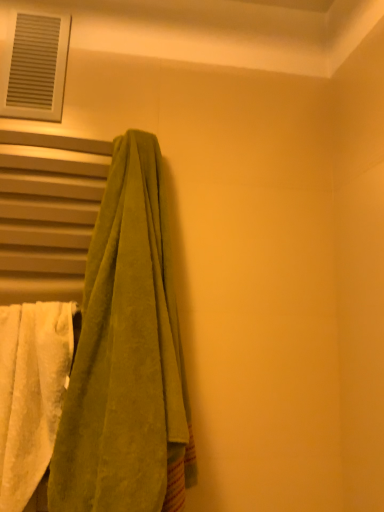
This screenshot has height=512, width=384. What do you see at coordinates (127, 356) in the screenshot?
I see `green velvety towel at left, the 1th towel in the right-to-left sequence` at bounding box center [127, 356].

Where is `white plastic vent at upper left`? white plastic vent at upper left is located at coordinates (35, 66).

Where is `green velvety towel at left, which is counted as the 2th towel, starting from the left`? This screenshot has width=384, height=512. green velvety towel at left, which is counted as the 2th towel, starting from the left is located at coordinates (127, 356).

From a real-world perspective, which is physically below, white plastic vent at upper left or white fluffy towel at left, placed as the 1th towel when sorted from left to right?

white fluffy towel at left, placed as the 1th towel when sorted from left to right.

Is white plastic vent at upper left positioned with its back to white fluffy towel at left, which is the second towel from right to left?

No, white plastic vent at upper left is not facing the opposite direction of white fluffy towel at left, which is the second towel from right to left.

From the image's perspective, which object appears higher, white plastic vent at upper left or white fluffy towel at left, which is the second towel from right to left?

white plastic vent at upper left.

Is white plastic vent at upper left placed right next to white fluffy towel at left, placed as the 1th towel when sorted from left to right?

No, white plastic vent at upper left is not making contact with white fluffy towel at left, placed as the 1th towel when sorted from left to right.

Which of these two, white fluffy towel at left, placed as the 1th towel when sorted from left to right, or green velvety towel at left, the 1th towel in the right-to-left sequence, is thinner?

With smaller width is white fluffy towel at left, placed as the 1th towel when sorted from left to right.

Could you tell me if white fluffy towel at left, placed as the 1th towel when sorted from left to right, is turned towards green velvety towel at left, the 1th towel in the right-to-left sequence?

No, white fluffy towel at left, placed as the 1th towel when sorted from left to right, is not facing towards green velvety towel at left, the 1th towel in the right-to-left sequence.

Considering the relative sizes of white fluffy towel at left, placed as the 1th towel when sorted from left to right, and green velvety towel at left, the 1th towel in the right-to-left sequence, in the image provided, is white fluffy towel at left, placed as the 1th towel when sorted from left to right, smaller than green velvety towel at left, the 1th towel in the right-to-left sequence,?

Yes, white fluffy towel at left, placed as the 1th towel when sorted from left to right, is smaller than green velvety towel at left, the 1th towel in the right-to-left sequence.

Consider the image. Considering the sizes of white plastic vent at upper left and green velvety towel at left, the 1th towel in the right-to-left sequence, in the image, is white plastic vent at upper left bigger or smaller than green velvety towel at left, the 1th towel in the right-to-left sequence,?

Clearly, white plastic vent at upper left is smaller in size than green velvety towel at left, the 1th towel in the right-to-left sequence.

From a real-world perspective, which object rests below the other?

In real-world perspective, green velvety towel at left, which is counted as the 2th towel, starting from the left, is lower.

From the image's perspective, which is below, white plastic vent at upper left or green velvety towel at left, the 1th towel in the right-to-left sequence?

green velvety towel at left, the 1th towel in the right-to-left sequence, from the image's perspective.

Is green velvety towel at left, the 1th towel in the right-to-left sequence, inside white plastic vent at upper left?

No, white plastic vent at upper left does not contain green velvety towel at left, the 1th towel in the right-to-left sequence.

Which of these two, green velvety towel at left, which is counted as the 2th towel, starting from the left, or white plastic vent at upper left, is bigger?

Bigger between the two is green velvety towel at left, which is counted as the 2th towel, starting from the left.

Considering the points (101, 476) and (10, 31), which point is in front, point (101, 476) or point (10, 31)?

The point (101, 476) is more forward.

Which object is thinner, green velvety towel at left, the 1th towel in the right-to-left sequence, or white plastic vent at upper left?

With smaller width is white plastic vent at upper left.

From the image's perspective, does green velvety towel at left, the 1th towel in the right-to-left sequence, appear higher than white plastic vent at upper left?

No.

From a real-world perspective, is green velvety towel at left, the 1th towel in the right-to-left sequence, positioned above or below white fluffy towel at left, which is the second towel from right to left?

In terms of real-world spatial position, green velvety towel at left, the 1th towel in the right-to-left sequence, is above white fluffy towel at left, which is the second towel from right to left.

Which is behind, green velvety towel at left, the 1th towel in the right-to-left sequence, or white fluffy towel at left, which is the second towel from right to left?

white fluffy towel at left, which is the second towel from right to left, is behind.

Is white fluffy towel at left, which is the second towel from right to left, far from white plastic vent at upper left?

No.

Is white plastic vent at upper left a part of white fluffy towel at left, placed as the 1th towel when sorted from left to right?

No, white fluffy towel at left, placed as the 1th towel when sorted from left to right, does not contain white plastic vent at upper left.

In the image, is white fluffy towel at left, placed as the 1th towel when sorted from left to right, on the left side or the right side of white plastic vent at upper left?

white fluffy towel at left, placed as the 1th towel when sorted from left to right, is to the right of white plastic vent at upper left.

Is the position of white fluffy towel at left, placed as the 1th towel when sorted from left to right, more distant than that of white plastic vent at upper left?

No.

In the image, there is a white fluffy towel at left, placed as the 1th towel when sorted from left to right. Find the location of `window above it (from the image's perspective)`. window above it (from the image's perspective) is located at coordinates (35, 66).

Find the location of a particular element. The image size is (384, 512). towel that appears in front of the white fluffy towel at left, which is the second towel from right to left is located at coordinates (127, 356).

From the image, which object appears to be nearer to green velvety towel at left, the 1th towel in the right-to-left sequence, white fluffy towel at left, which is the second towel from right to left, or white plastic vent at upper left?

Based on the image, white fluffy towel at left, which is the second towel from right to left, appears to be nearer to green velvety towel at left, the 1th towel in the right-to-left sequence.

Considering their positions, is white plastic vent at upper left positioned closer to white fluffy towel at left, placed as the 1th towel when sorted from left to right, than green velvety towel at left, the 1th towel in the right-to-left sequence?

green velvety towel at left, the 1th towel in the right-to-left sequence, is closer to white fluffy towel at left, placed as the 1th towel when sorted from left to right.

Looking at the image, which one is located further to white fluffy towel at left, placed as the 1th towel when sorted from left to right, green velvety towel at left, which is counted as the 2th towel, starting from the left, or white plastic vent at upper left?

white plastic vent at upper left.

Estimate the real-world distances between objects in this image. Which object is further from green velvety towel at left, the 1th towel in the right-to-left sequence, white plastic vent at upper left or white fluffy towel at left, placed as the 1th towel when sorted from left to right?

The object further to green velvety towel at left, the 1th towel in the right-to-left sequence, is white plastic vent at upper left.

When comparing their distances from white plastic vent at upper left, does white fluffy towel at left, which is the second towel from right to left, or green velvety towel at left, the 1th towel in the right-to-left sequence, seem closer?

green velvety towel at left, the 1th towel in the right-to-left sequence, is closer to white plastic vent at upper left.

Considering their positions, is green velvety towel at left, which is counted as the 2th towel, starting from the left, positioned closer to white plastic vent at upper left than white fluffy towel at left, placed as the 1th towel when sorted from left to right?

Among the two, green velvety towel at left, which is counted as the 2th towel, starting from the left, is located nearer to white plastic vent at upper left.

Image resolution: width=384 pixels, height=512 pixels. Find the location of `towel between white plastic vent at upper left and white fluffy towel at left, which is the second towel from right to left, in the up-down direction`. towel between white plastic vent at upper left and white fluffy towel at left, which is the second towel from right to left, in the up-down direction is located at coordinates (127, 356).